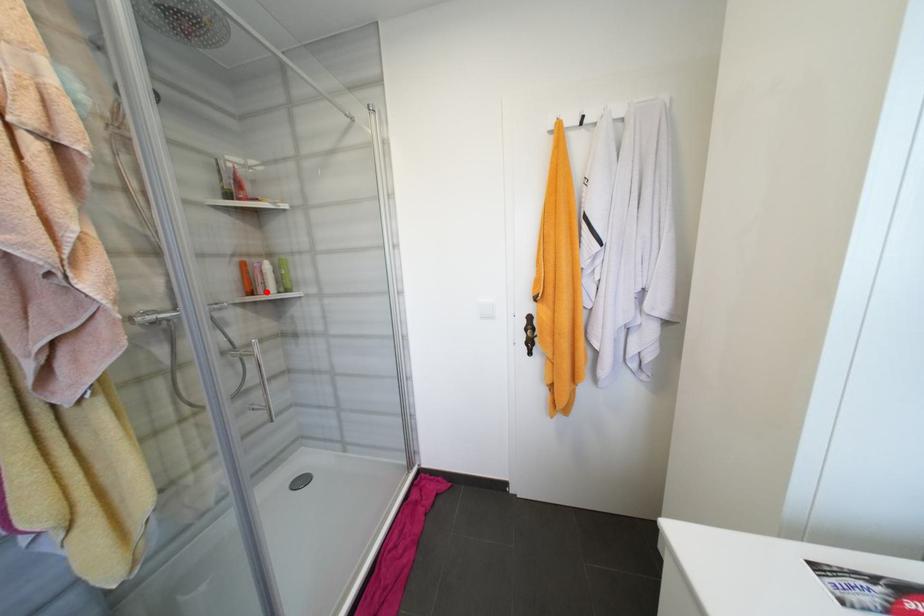
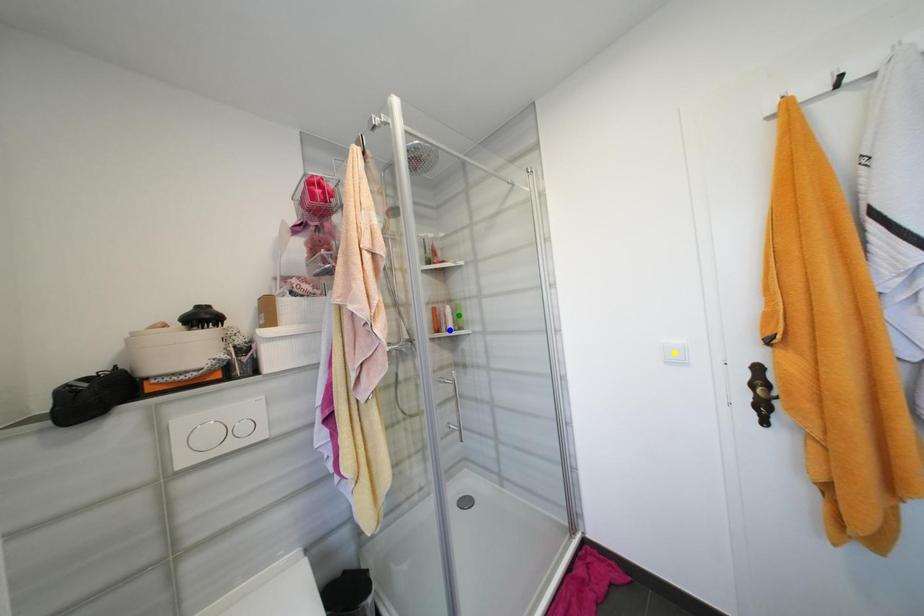
Question: I am providing you with two images of the same scene from different viewpoints. A red point is marked on the first image. You are given multiple points on the second image. Which point in image 2 is actually the same real-world point as the red point in image 1?

Choices:
 (A) green point
 (B) yellow point
 (C) blue point

Answer: (C)